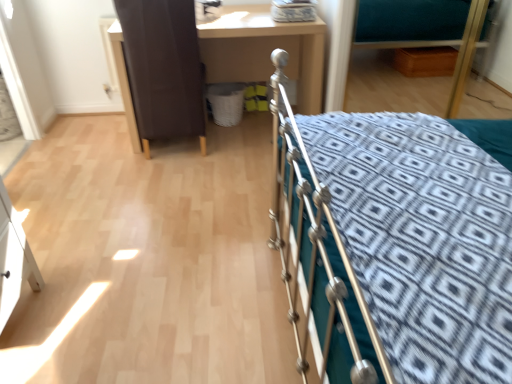
Question: Is the depth of teal fabric hospital bed at upper right greater than that of matte brown desk at center?

Choices:
 (A) yes
 (B) no

Answer: (B)

Question: From a real-world perspective, is teal fabric hospital bed at upper right physically above matte brown desk at center?

Choices:
 (A) yes
 (B) no

Answer: (A)

Question: From the image's perspective, does teal fabric hospital bed at upper right appear lower than matte brown desk at center?

Choices:
 (A) yes
 (B) no

Answer: (B)

Question: From the image's perspective, is teal fabric hospital bed at upper right on matte brown desk at center?

Choices:
 (A) no
 (B) yes

Answer: (B)

Question: Considering the relative positions of teal fabric hospital bed at upper right and matte brown desk at center in the image provided, is teal fabric hospital bed at upper right in front of matte brown desk at center?

Choices:
 (A) yes
 (B) no

Answer: (A)

Question: Considering the positions of teal fabric hospital bed at upper right and silver metallic bed at right in the image, is teal fabric hospital bed at upper right taller or shorter than silver metallic bed at right?

Choices:
 (A) tall
 (B) short

Answer: (B)

Question: Which is correct: teal fabric hospital bed at upper right is inside silver metallic bed at right, or outside of it?

Choices:
 (A) outside
 (B) inside

Answer: (A)

Question: Considering the positions of teal fabric hospital bed at upper right and silver metallic bed at right in the image, is teal fabric hospital bed at upper right wider or thinner than silver metallic bed at right?

Choices:
 (A) wide
 (B) thin

Answer: (B)

Question: Considering the positions of point (385, 9) and point (409, 367), is point (385, 9) closer or farther from the camera than point (409, 367)?

Choices:
 (A) farther
 (B) closer

Answer: (A)

Question: In the image, is silver metallic bed at right positioned in front of or behind teal fabric hospital bed at upper right?

Choices:
 (A) behind
 (B) front

Answer: (B)

Question: Based on their positions, is silver metallic bed at right located to the left or right of teal fabric hospital bed at upper right?

Choices:
 (A) right
 (B) left

Answer: (B)

Question: Looking at their shapes, would you say silver metallic bed at right is wider or thinner than teal fabric hospital bed at upper right?

Choices:
 (A) wide
 (B) thin

Answer: (A)

Question: Is point (286, 251) closer or farther from the camera than point (471, 36)?

Choices:
 (A) closer
 (B) farther

Answer: (A)

Question: Considering the positions of teal fabric hospital bed at upper right and brown leather screen door at upper left in the image, is teal fabric hospital bed at upper right bigger or smaller than brown leather screen door at upper left?

Choices:
 (A) big
 (B) small

Answer: (B)

Question: From a real-world perspective, is teal fabric hospital bed at upper right positioned above or below brown leather screen door at upper left?

Choices:
 (A) above
 (B) below

Answer: (A)